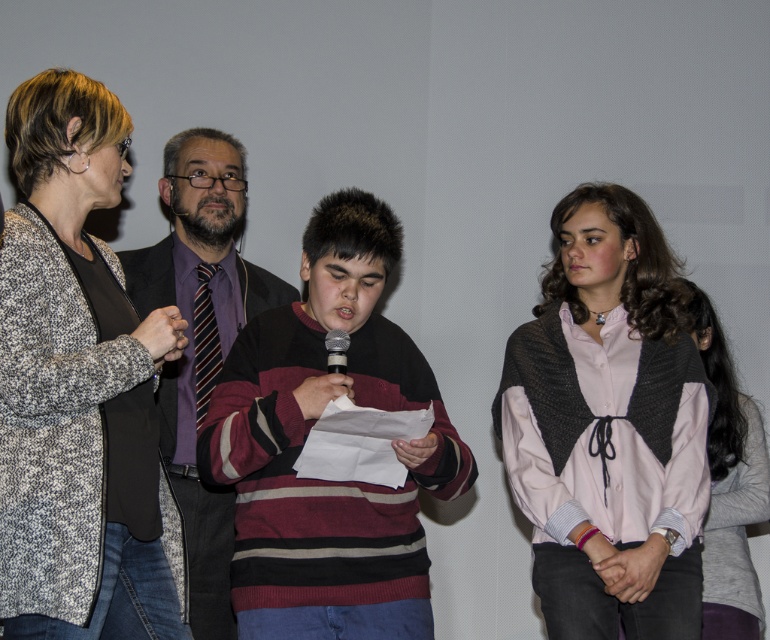
Question: Which of the following is the closest to the observer?

Choices:
 (A) (323, 224)
 (B) (223, 196)
 (C) (693, 310)

Answer: (A)

Question: Among these objects, which one is nearest to the camera?

Choices:
 (A) maroon striped sweater at center
 (B) striped sweater at center

Answer: (A)

Question: Does gray sweater at center appear on the right side of metallic silver microphone at center?

Choices:
 (A) no
 (B) yes

Answer: (B)

Question: Is gray sweater at center further to the viewer compared to striped fabric tie at center?

Choices:
 (A) yes
 (B) no

Answer: (A)

Question: Estimate the real-world distances between objects in this image. Which object is farther from the striped sweater at center?

Choices:
 (A) gray sweater at center
 (B) metallic silver microphone at center

Answer: (A)

Question: Is speckled woolen cardigan at left thinner than striped sweater at center?

Choices:
 (A) no
 (B) yes

Answer: (B)